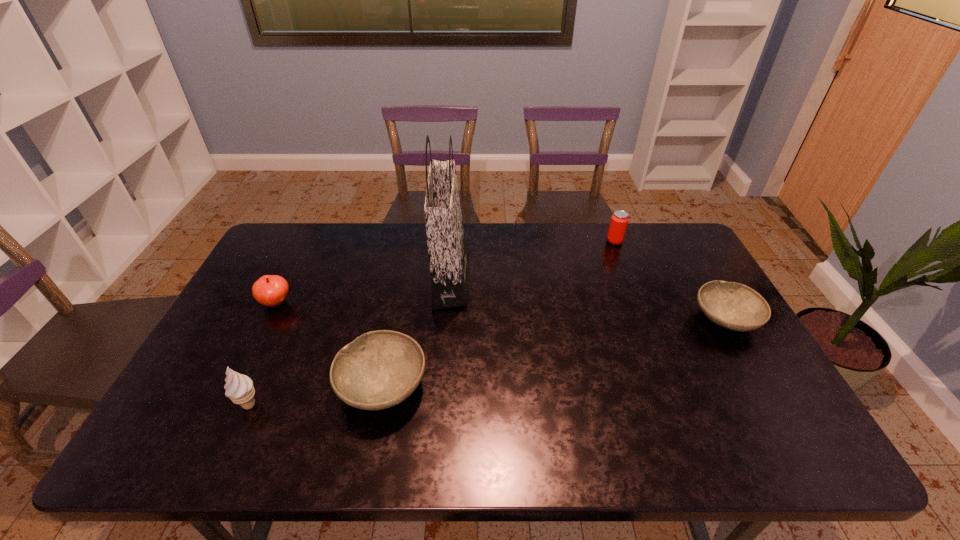
What are the coordinates of `the left bowl` in the screenshot? It's located at (379, 369).

Where is `the taller bowl`? The width and height of the screenshot is (960, 540). the taller bowl is located at coordinates (379, 369).

Locate an element on the screen. The image size is (960, 540). the right bowl is located at coordinates (734, 306).

Find the location of `the shortest object`. the shortest object is located at coordinates (734, 306).

Where is `apple`? The height and width of the screenshot is (540, 960). apple is located at coordinates (270, 290).

Locate an element on the screen. This screenshot has width=960, height=540. the farthest object is located at coordinates (619, 220).

Identify the location of the fifth object from left to right. The height and width of the screenshot is (540, 960). (619, 220).

Where is `shopping bag`? The width and height of the screenshot is (960, 540). shopping bag is located at coordinates (448, 253).

Locate an element on the screen. The image size is (960, 540). the fifth shortest object is located at coordinates (239, 388).

Where is `vacant region located on the left of the nearer bowl`? The image size is (960, 540). vacant region located on the left of the nearer bowl is located at coordinates (233, 386).